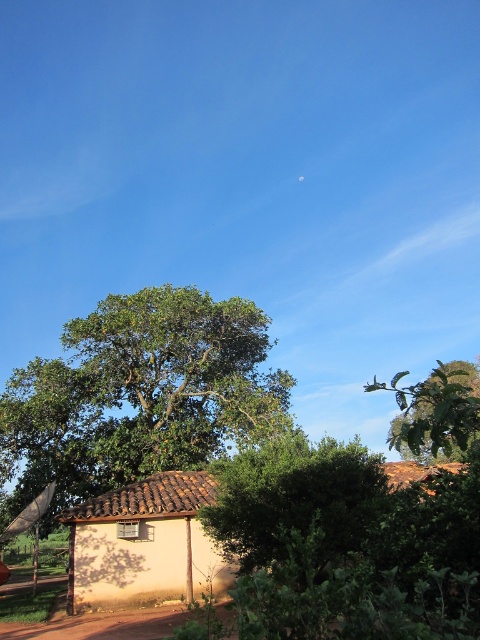
Does green leafy tree at center appear on the left side of brown dirt track at lower left?

Correct, you'll find green leafy tree at center to the left of brown dirt track at lower left.

From the picture: Who is positioned more to the left, green leafy tree at center or brown dirt track at lower left?

green leafy tree at center

Is point (228, 364) positioned in front of point (80, 632)?

No, (228, 364) is behind (80, 632).

At what (x,y) coordinates should I click in order to perform the action: click on green leafy tree at center. Please return your answer as a coordinate pair (x, y). Looking at the image, I should click on (140, 394).

Which is more to the left, green leafy tree at upper right or brown dirt track at lower left?

Positioned to the left is brown dirt track at lower left.

Does green leafy tree at upper right have a smaller size compared to brown dirt track at lower left?

Actually, green leafy tree at upper right might be larger than brown dirt track at lower left.

What do you see at coordinates (436, 412) in the screenshot? I see `green leafy tree at upper right` at bounding box center [436, 412].

Locate an element on the screen. The height and width of the screenshot is (640, 480). green leafy tree at upper right is located at coordinates (436, 412).

Is green leafy tree at center to the right of beige clay hut at center from the viewer's perspective?

In fact, green leafy tree at center is to the left of beige clay hut at center.

Which of these two, green leafy tree at center or beige clay hut at center, stands shorter?

beige clay hut at center

Find the location of a particular element. This screenshot has height=640, width=480. green leafy tree at center is located at coordinates (140, 394).